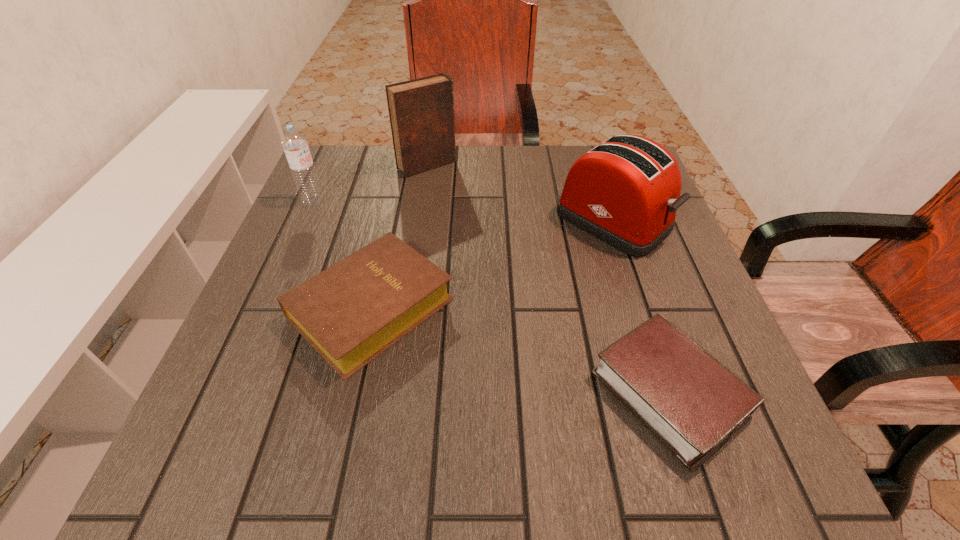
Locate an element on the screen. The width and height of the screenshot is (960, 540). vacant area at the far edge of the desktop is located at coordinates (531, 197).

Identify the location of free space at the near edge. The width and height of the screenshot is (960, 540). (409, 454).

You are a GUI agent. You are given a task and a screenshot of the screen. Output one action in this format:
    pyautogui.click(x=<x>, y=<y>)
    Task: Click on the blank space at the left edge of the desktop
    Image resolution: width=960 pixels, height=540 pixels.
    Given the screenshot: What is the action you would take?
    pyautogui.click(x=230, y=387)

Find the location of `free region at the right edge`. free region at the right edge is located at coordinates (671, 234).

Locate an element on the screen. This screenshot has height=540, width=960. vacant space at the far left corner of the desktop is located at coordinates (330, 151).

In order to click on vacant position at the near left corner of the desktop in this screenshot , I will do `click(211, 464)`.

Locate an element on the screen. The width and height of the screenshot is (960, 540). vacant area at the near right corner is located at coordinates [764, 440].

The image size is (960, 540). Find the location of `free space between the rightmost Bible and the water bottle`. free space between the rightmost Bible and the water bottle is located at coordinates (492, 297).

I want to click on free area in between the tallest Bible and the rightmost Bible, so click(x=548, y=280).

This screenshot has width=960, height=540. Find the location of `free spot between the toaster and the rightmost Bible`. free spot between the toaster and the rightmost Bible is located at coordinates (641, 307).